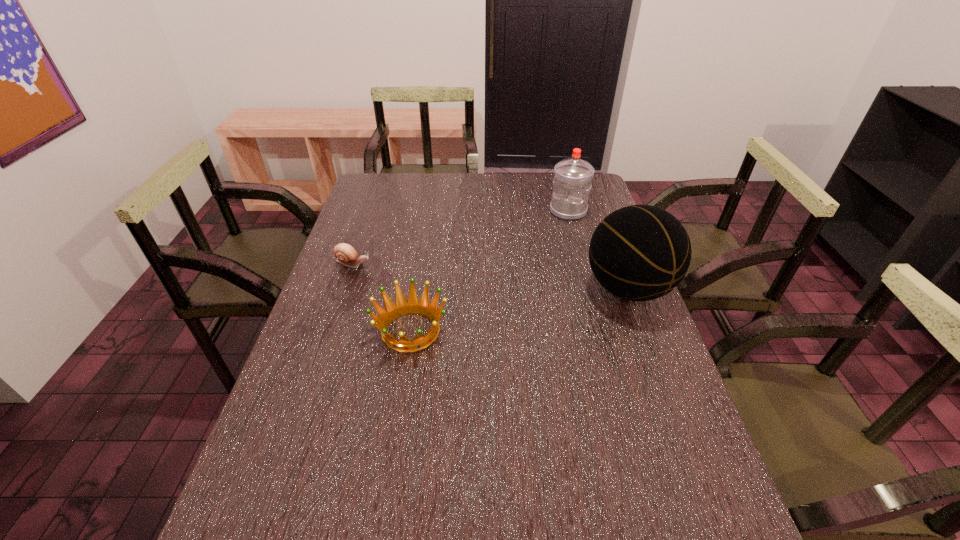
Find the location of a particular element. The image size is (960, 540). vacant region at the near edge of the desktop is located at coordinates (444, 484).

Locate an element on the screen. Image resolution: width=960 pixels, height=540 pixels. vacant area at the left edge of the desktop is located at coordinates (352, 271).

What are the coordinates of `free location at the right edge of the desktop` in the screenshot? It's located at (636, 399).

In the image, there is a desktop. Where is `free region at the far left corner`? free region at the far left corner is located at coordinates (362, 188).

Image resolution: width=960 pixels, height=540 pixels. Find the location of `vacant area at the near left corner`. vacant area at the near left corner is located at coordinates (309, 507).

The height and width of the screenshot is (540, 960). In order to click on free area in between the water bottle and the second object from left to right in this screenshot , I will do `click(490, 271)`.

Identify the location of empty space that is in between the third tallest object and the basketball. (519, 309).

Where is `vacant space that's between the third tallest object and the water bottle`? Image resolution: width=960 pixels, height=540 pixels. vacant space that's between the third tallest object and the water bottle is located at coordinates [x=490, y=271].

The image size is (960, 540). What are the coordinates of `vacant area that lies between the basketball and the crown` in the screenshot? It's located at (519, 309).

Identify the location of free space between the basketball and the leftmost object. This screenshot has height=540, width=960. (491, 276).